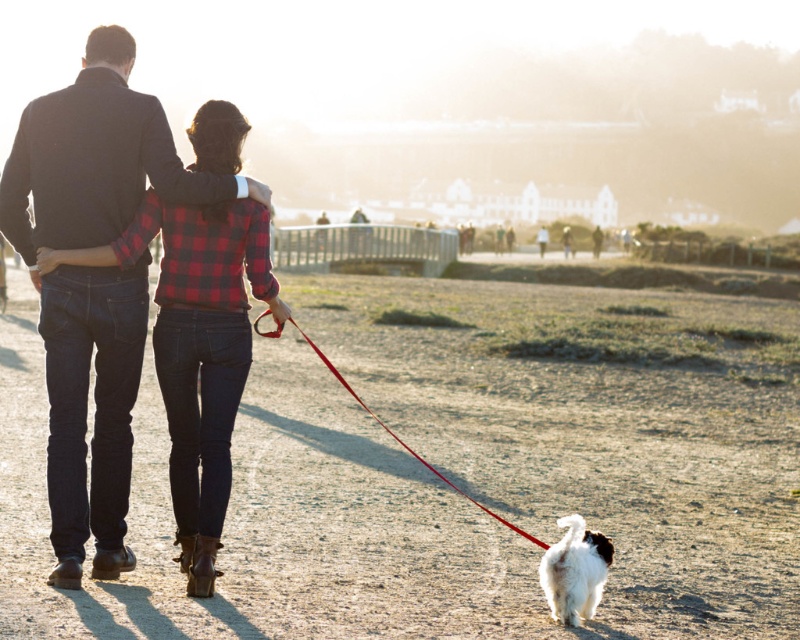
Question: Is fluffy white dog at lower center above red nylon leash at lower center?

Choices:
 (A) yes
 (B) no

Answer: (B)

Question: From the image, what is the correct spatial relationship of dark blue jeans at center in relation to fluffy white dog at lower center?

Choices:
 (A) below
 (B) above

Answer: (B)

Question: Which object appears farthest from the camera in this image?

Choices:
 (A) red nylon leash at lower center
 (B) dark blue jeans at center

Answer: (B)

Question: Which object is positioned farthest from the dark blue jeans at center?

Choices:
 (A) red nylon leash at lower center
 (B) fluffy white dog at lower center

Answer: (B)

Question: Considering the real-world distances, which object is closest to the fluffy white dog at lower center?

Choices:
 (A) dark blue jeans at center
 (B) red nylon leash at lower center

Answer: (B)

Question: Does dark blue jeans at center appear on the right side of fluffy white dog at lower center?

Choices:
 (A) yes
 (B) no

Answer: (B)